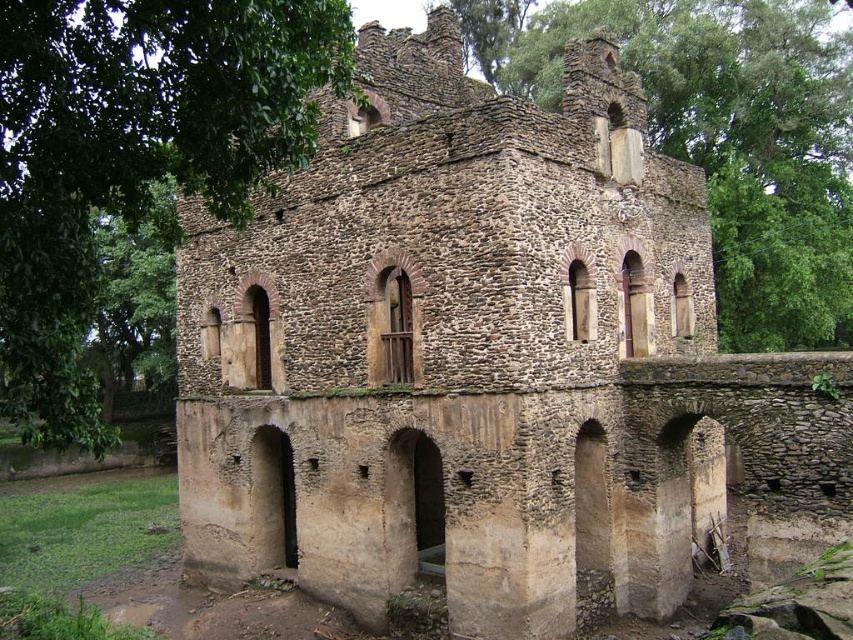
Does green leafy tree at left have a smaller size compared to green leafy tree at upper center?

Incorrect, green leafy tree at left is not smaller in size than green leafy tree at upper center.

Is green leafy tree at left to the left of green leafy tree at upper center from the viewer's perspective?

Correct, you'll find green leafy tree at left to the left of green leafy tree at upper center.

Is point (190, 182) in front of point (728, 344)?

Yes, point (190, 182) is closer to viewer.

Image resolution: width=853 pixels, height=640 pixels. Identify the location of green leafy tree at left. (132, 156).